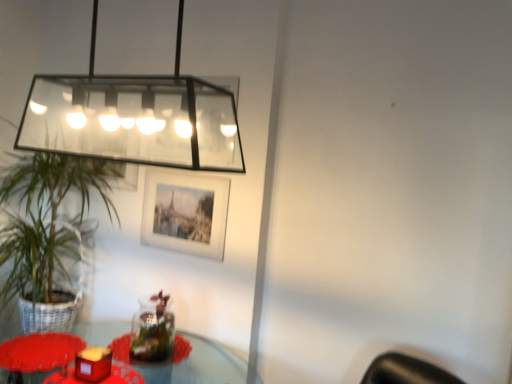
I want to click on free space that is to the left of matte red candle holder at lower left, so click(x=51, y=364).